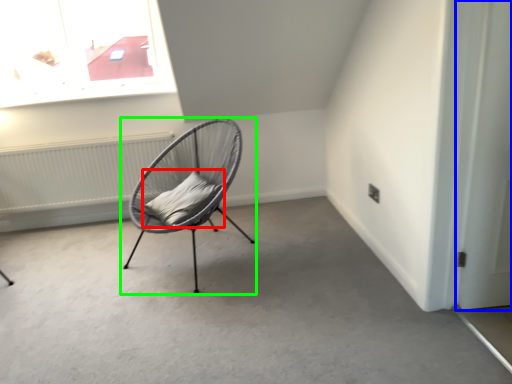
Question: Considering the real-world distances, which object is farthest from pillow (highlighted by a red box)? door (highlighted by a blue box) or chair (highlighted by a green box)?

Choices:
 (A) door
 (B) chair

Answer: (A)